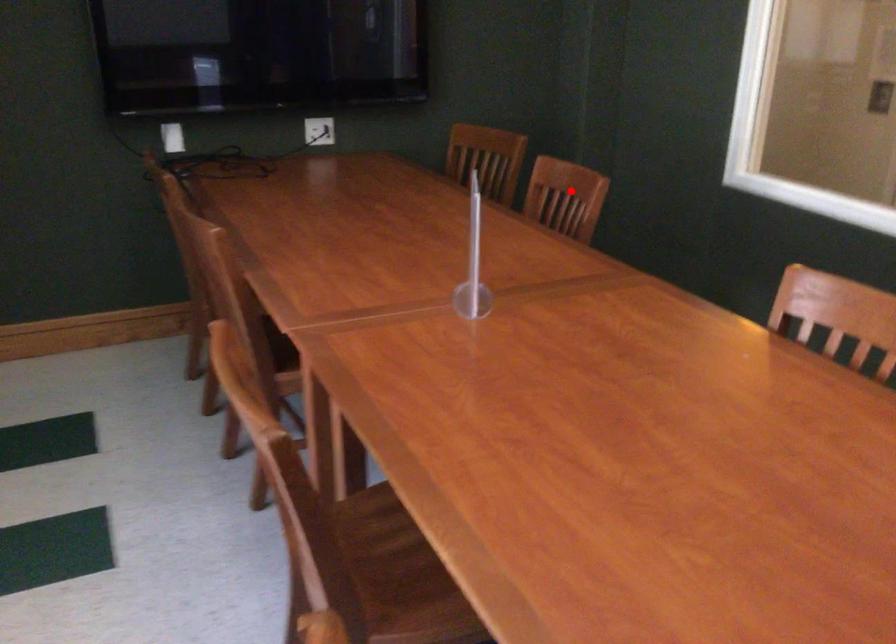
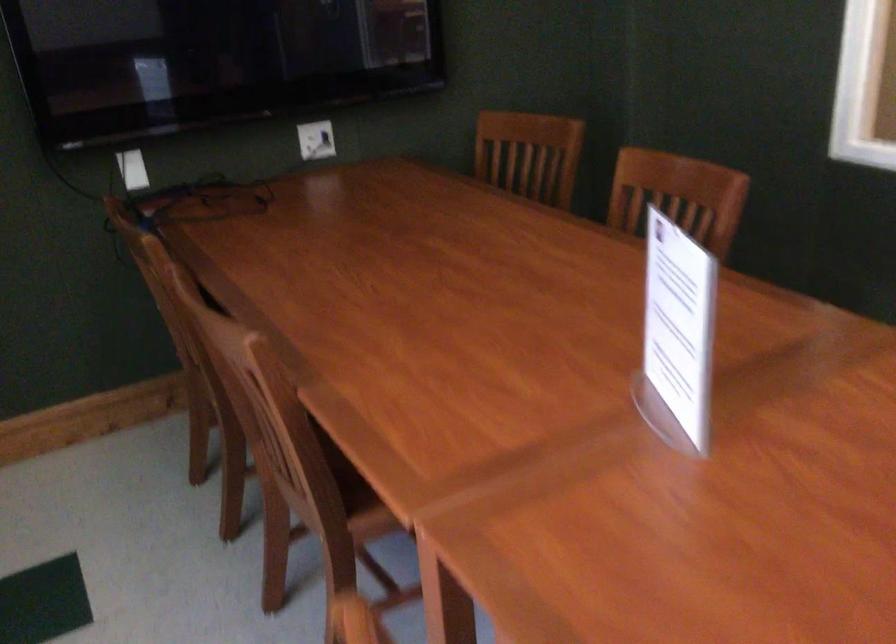
Question: A red point is marked in image1. In image2, is the corresponding 3D point closer to the camera or farther? Reply with the corresponding letter.

Choices:
 (A) The corresponding 3D point is closer.
 (B) The corresponding 3D point is farther.

Answer: (A)